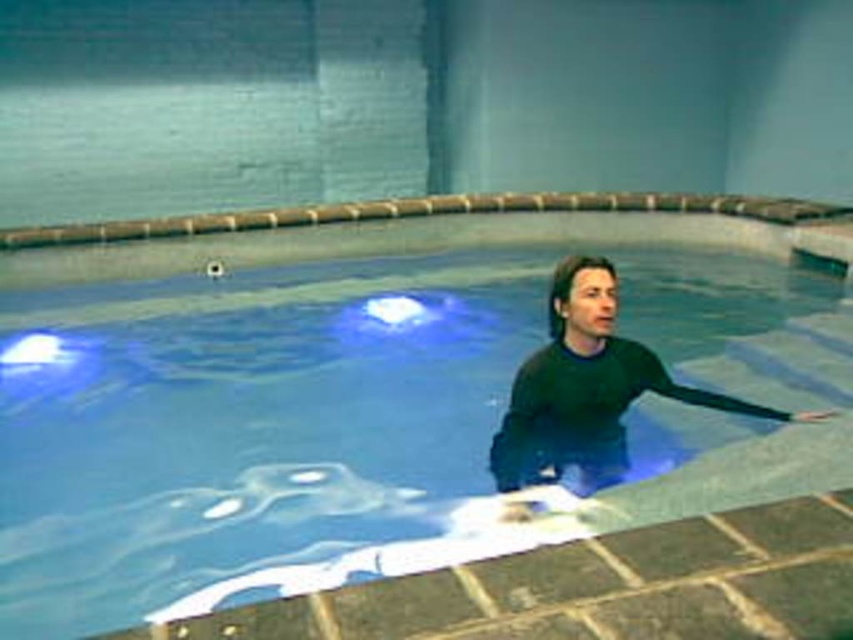
Who is higher up, transparent glass swimming pool at center or black matte wetsuit at center?

transparent glass swimming pool at center is higher up.

Is transparent glass swimming pool at center below black matte wetsuit at center?

No, transparent glass swimming pool at center is not below black matte wetsuit at center.

This screenshot has height=640, width=853. I want to click on transparent glass swimming pool at center, so click(370, 401).